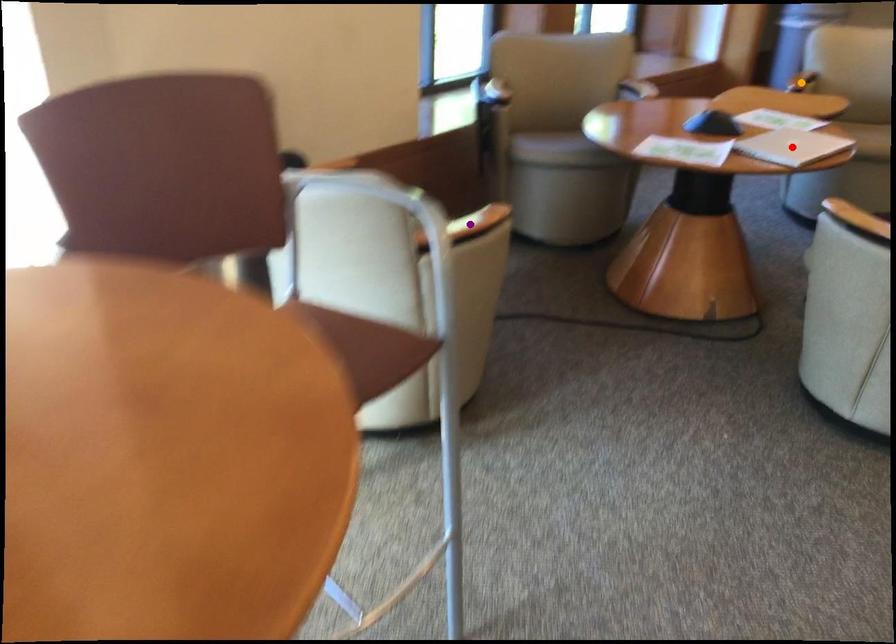
Looking at this image, order these from nearest to farthest:
1. orange point
2. purple point
3. red point

purple point
red point
orange point